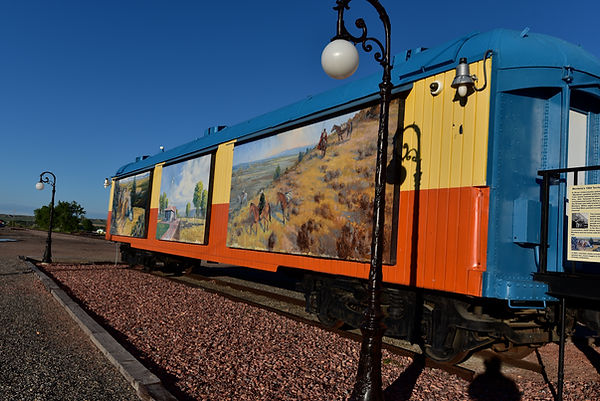
I want to click on paintings, so click(311, 207), click(184, 206), click(126, 209).